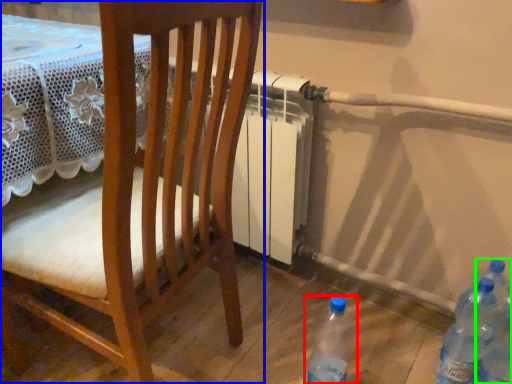
Question: Which object is positioned closest to bottle (highlighted by a red box)? Select from chair (highlighted by a blue box) and bottle (highlighted by a green box).

Choices:
 (A) chair
 (B) bottle

Answer: (B)